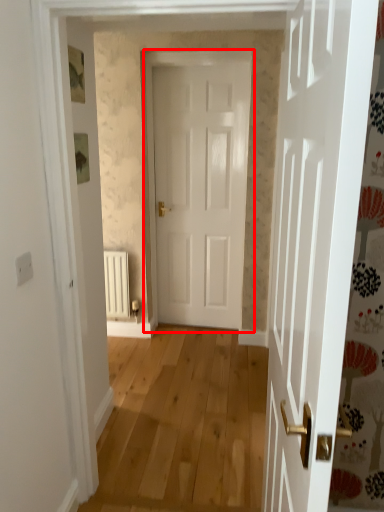
Question: From the image, what is the correct spatial relationship of door (annotated by the red box) in relation to radiator?

Choices:
 (A) left
 (B) right

Answer: (B)